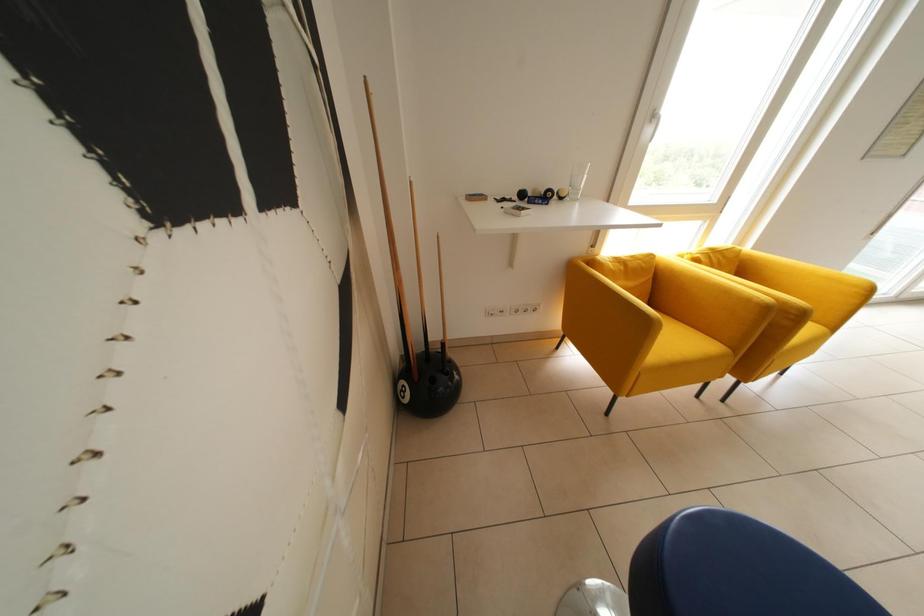
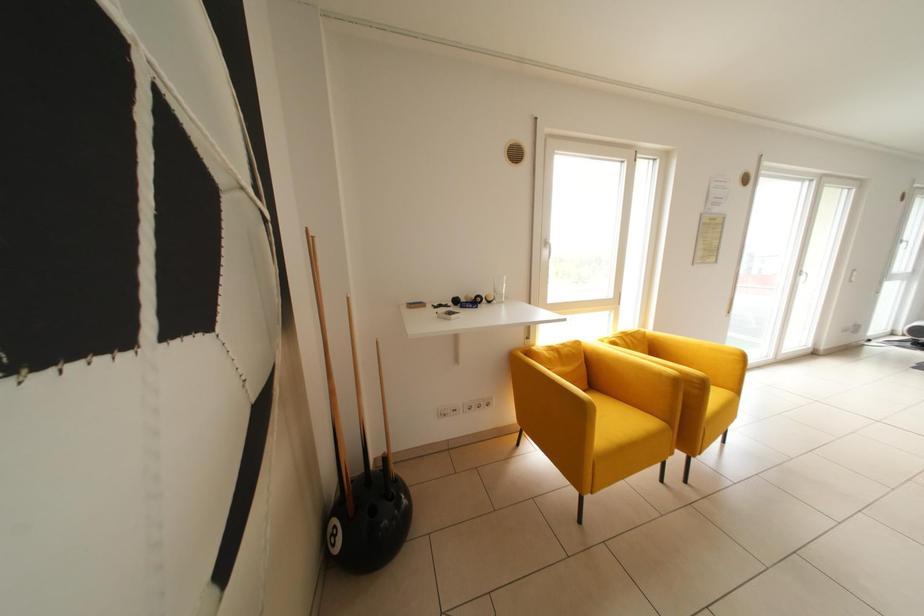
Question: The first image is from the beginning of the video and the second image is from the end. How did the camera likely rotate when shooting the video?

Choices:
 (A) Left
 (B) Right
 (C) Up
 (D) Down

Answer: (C)